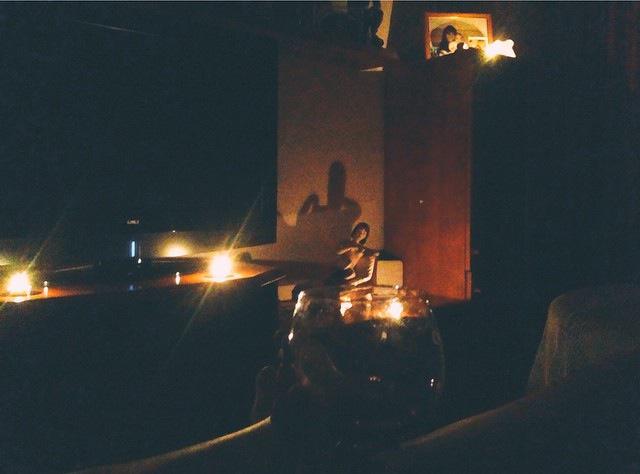
This screenshot has width=640, height=474. I want to click on foot stand for flat screen tv, so click(x=139, y=267).